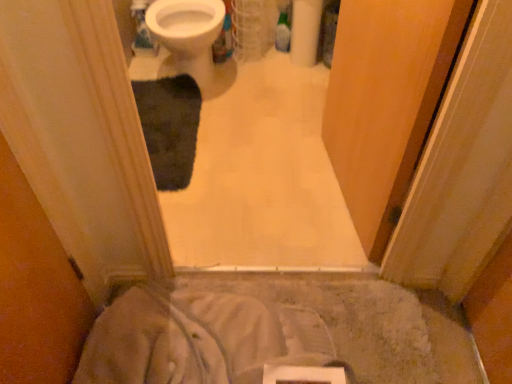
Identify the location of unoccupied space behind wooden screen door at center. (285, 124).